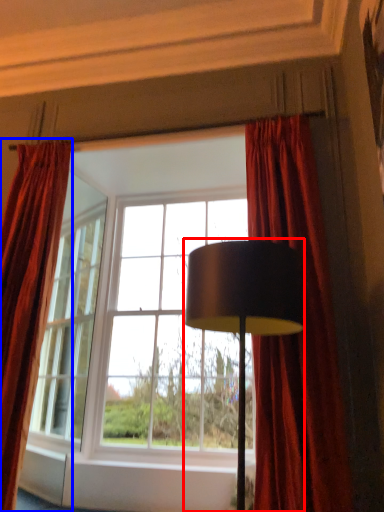
Question: Which object is closer to the camera taking this photo, lamp (highlighted by a red box) or curtain (highlighted by a blue box)?

Choices:
 (A) lamp
 (B) curtain

Answer: (A)